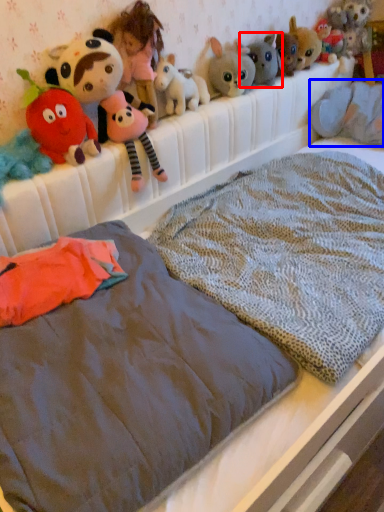
Question: Among these objects, which one is farthest to the camera, toy (highlighted by a red box) or animal (highlighted by a blue box)?

Choices:
 (A) toy
 (B) animal

Answer: (B)